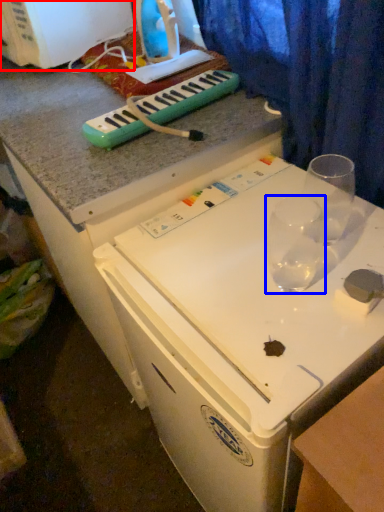
Question: Which of the following is the farthest to the observer, appliance (highlighted by a red box) or martini glass (highlighted by a blue box)?

Choices:
 (A) appliance
 (B) martini glass

Answer: (A)